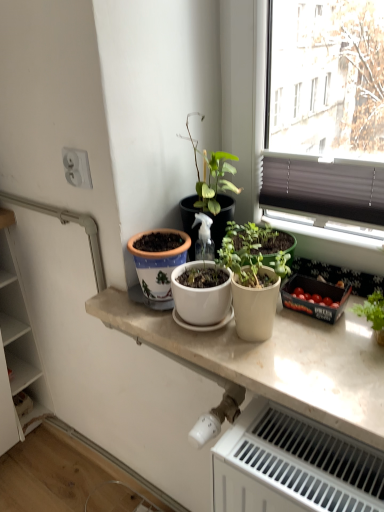
Identify the location of free location in front of white ceramic pot at center. (176, 335).